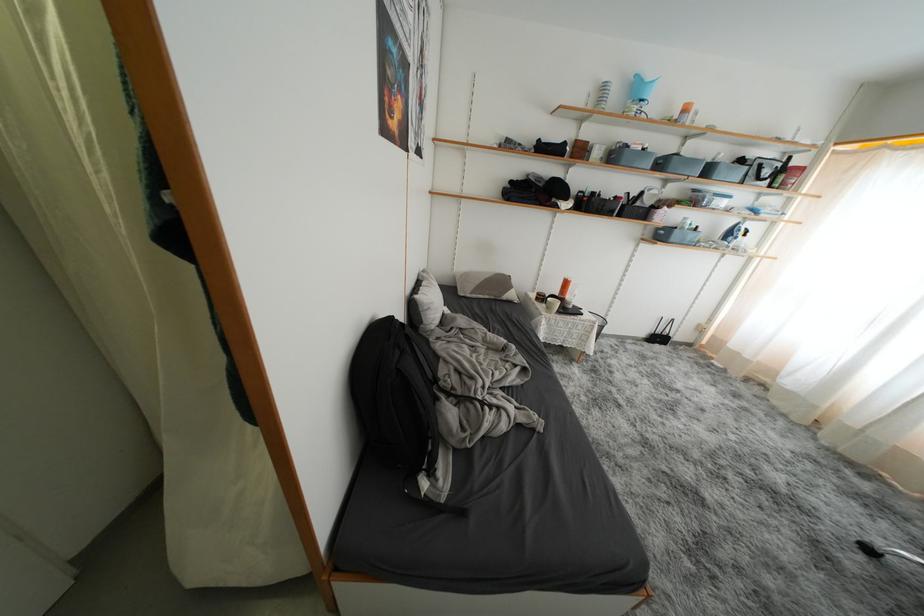
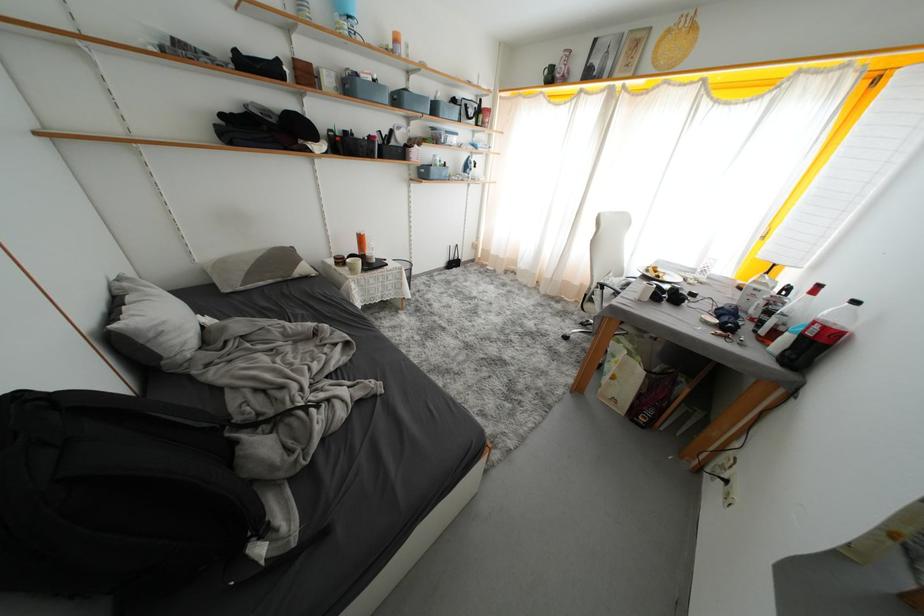
Based on the photo, based on the continuous images, in which direction is the camera rotating?

The camera rotated toward right-down.